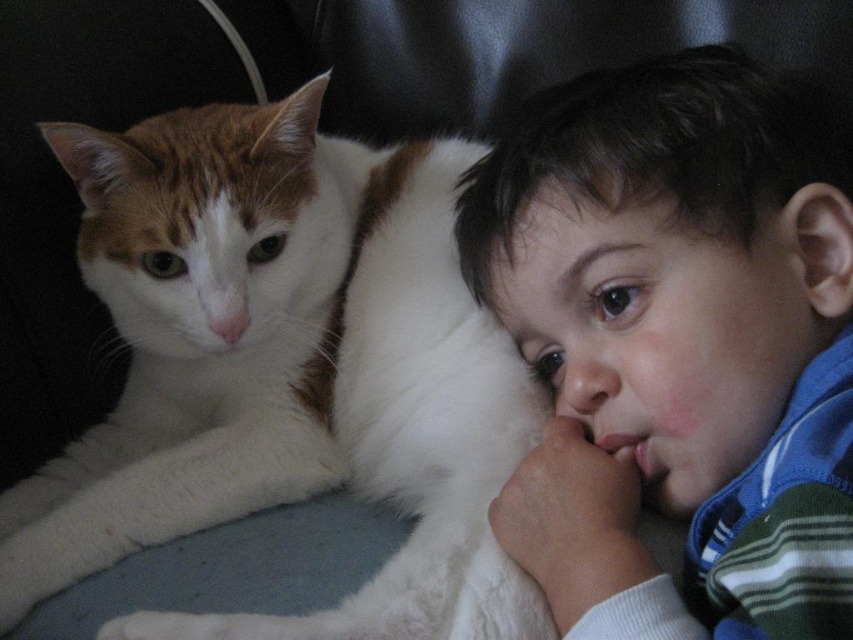
Does white soft fur cat at left lie in front of smooth blue striped shirt at right?

No, it is behind smooth blue striped shirt at right.

What do you see at coordinates (283, 371) in the screenshot?
I see `white soft fur cat at left` at bounding box center [283, 371].

The height and width of the screenshot is (640, 853). In order to click on white soft fur cat at left in this screenshot , I will do `click(283, 371)`.